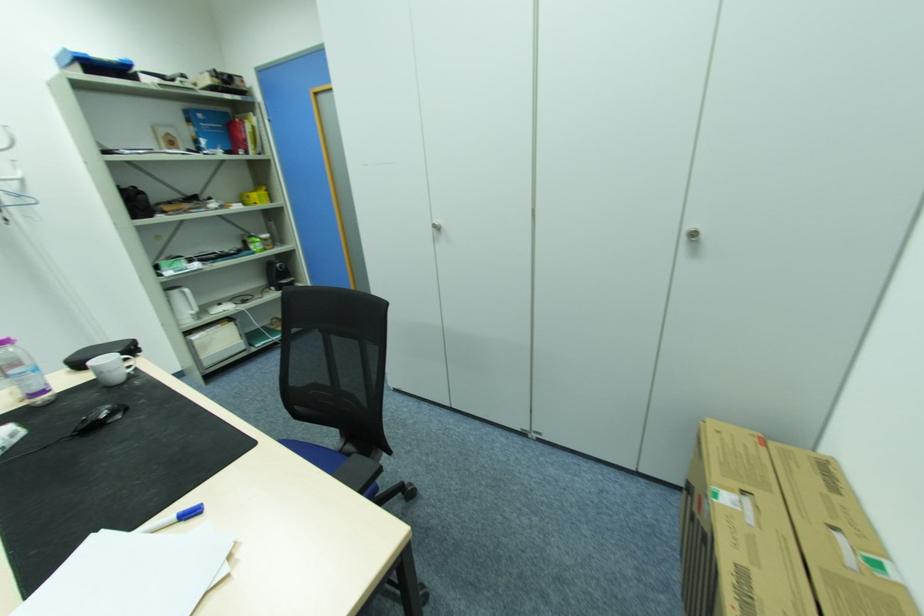
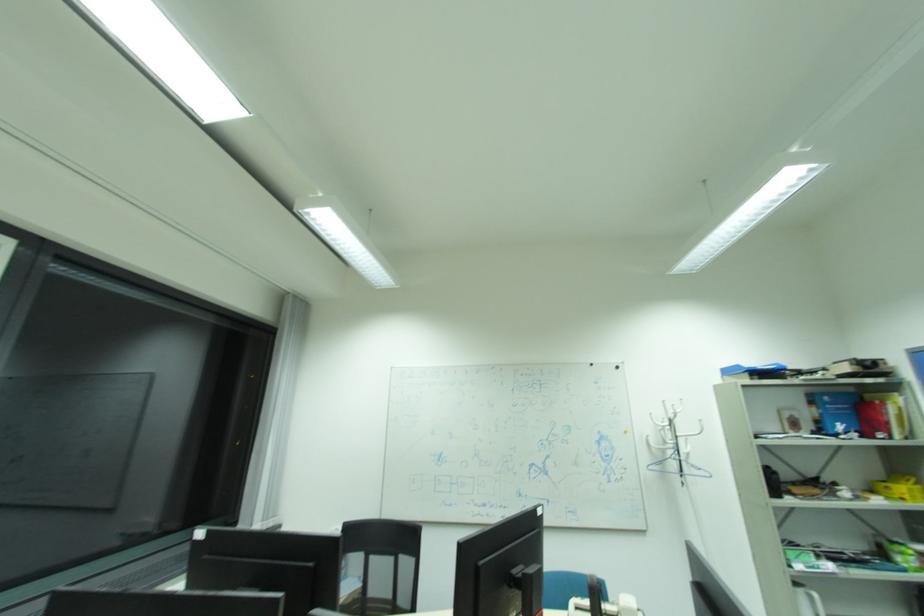
The images are taken continuously from a first-person perspective. In which direction is your viewpoint rotating?

The camera rotated toward left-up.